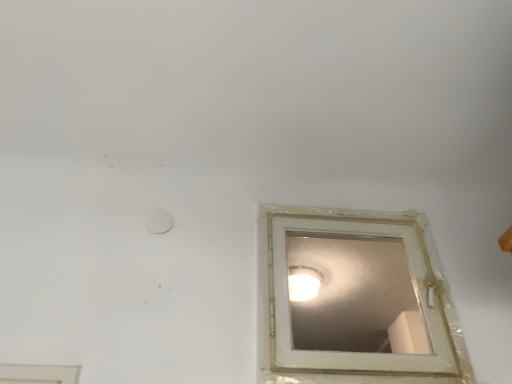
Describe the element at coordinates (303, 283) in the screenshot. The width and height of the screenshot is (512, 384). I see `white glossy light fixture at upper center` at that location.

Find the location of a particular element. This screenshot has height=384, width=512. white glossy light fixture at upper center is located at coordinates (x=303, y=283).

You are a GUI agent. You are given a task and a screenshot of the screen. Output one action in this format:
    pyautogui.click(x=<x>, y=<y>)
    Task: Click on the white plastic window at center
    The image size is (512, 384).
    Given the screenshot: What is the action you would take?
    pyautogui.click(x=340, y=350)

This screenshot has height=384, width=512. What do you see at coordinates (340, 350) in the screenshot?
I see `white plastic window at center` at bounding box center [340, 350].

Find the location of `white glossy light fixture at upper center`. white glossy light fixture at upper center is located at coordinates (303, 283).

Based on the photo, considering the positions of objects white plastic window at center and white glossy light fixture at upper center in the image provided, who is more to the right, white plastic window at center or white glossy light fixture at upper center?

Positioned to the right is white plastic window at center.

Does white plastic window at center come behind white glossy light fixture at upper center?

No, the depth of white plastic window at center is less than that of white glossy light fixture at upper center.

Between point (311, 231) and point (291, 286), which one is positioned behind?

The point (291, 286) is more distant.

In the scene shown: From the image's perspective, who appears lower, white plastic window at center or white glossy light fixture at upper center?

From the image's view, white glossy light fixture at upper center is below.

From a real-world perspective, who is located lower, white plastic window at center or white glossy light fixture at upper center?

In real-world perspective, white plastic window at center is lower.

Consider the image. Considering the sizes of objects white plastic window at center and white glossy light fixture at upper center in the image provided, who is thinner, white plastic window at center or white glossy light fixture at upper center?

With smaller width is white plastic window at center.

Considering the sizes of objects white plastic window at center and white glossy light fixture at upper center in the image provided, who is taller, white plastic window at center or white glossy light fixture at upper center?

white plastic window at center is taller.

Considering the relative sizes of white plastic window at center and white glossy light fixture at upper center in the image provided, is white plastic window at center bigger than white glossy light fixture at upper center?

Yes.

Can we say white plastic window at center lies outside white glossy light fixture at upper center?

Yes.

Is there a large distance between white plastic window at center and white glossy light fixture at upper center?

No, white plastic window at center is not far away from white glossy light fixture at upper center.

Is white plastic window at center aimed at white glossy light fixture at upper center?

No, white plastic window at center is not turned towards white glossy light fixture at upper center.

What's the angular difference between white plastic window at center and white glossy light fixture at upper center's facing directions?

The facing directions of white plastic window at center and white glossy light fixture at upper center are 89.9 degrees apart.

Find the location of a particular element. This screenshot has width=512, height=384. window below the white glossy light fixture at upper center (from a real-world perspective) is located at coordinates (340, 350).

Is white glossy light fixture at upper center to the right of white plastic window at center from the viewer's perspective?

No, white glossy light fixture at upper center is not to the right of white plastic window at center.

Is white glossy light fixture at upper center positioned in front of white plastic window at center?

No, white glossy light fixture at upper center is behind white plastic window at center.

Which point is more forward, (303, 290) or (281, 209)?

Positioned in front is point (281, 209).

From the image's perspective, would you say white glossy light fixture at upper center is shown under white plastic window at center?

Indeed, from the image's perspective, white glossy light fixture at upper center is shown beneath white plastic window at center.

From a real-world perspective, does white glossy light fixture at upper center stand above white plastic window at center?

Yes, from a real-world perspective, white glossy light fixture at upper center is on top of white plastic window at center.

Which of these two, white glossy light fixture at upper center or white plastic window at center, is thinner?

Thinner between the two is white plastic window at center.

Is white glossy light fixture at upper center taller or shorter than white plastic window at center?

In the image, white glossy light fixture at upper center appears to be shorter than white plastic window at center.

Who is bigger, white glossy light fixture at upper center or white plastic window at center?

white plastic window at center is bigger.

Is white glossy light fixture at upper center completely or partially outside of white plastic window at center?

white glossy light fixture at upper center lies outside white plastic window at center's area.

Is white glossy light fixture at upper center not close to white plastic window at center?

No, white glossy light fixture at upper center is not far away from white plastic window at center.

Is white glossy light fixture at upper center turned away from white plastic window at center?

No, white glossy light fixture at upper center is not facing the opposite direction of white plastic window at center.

How distant is white glossy light fixture at upper center from white plastic window at center?

white glossy light fixture at upper center is 30.29 inches away from white plastic window at center.

This screenshot has height=384, width=512. I want to click on window on the right of white glossy light fixture at upper center, so click(340, 350).

You are a GUI agent. You are given a task and a screenshot of the screen. Output one action in this format:
    pyautogui.click(x=<x>, y=<y>)
    Task: Click on the lighting behind the white plastic window at center
    
    Given the screenshot: What is the action you would take?
    pyautogui.click(x=303, y=283)

Find the location of a particular element. This screenshot has height=384, width=512. window on the right of white glossy light fixture at upper center is located at coordinates (340, 350).